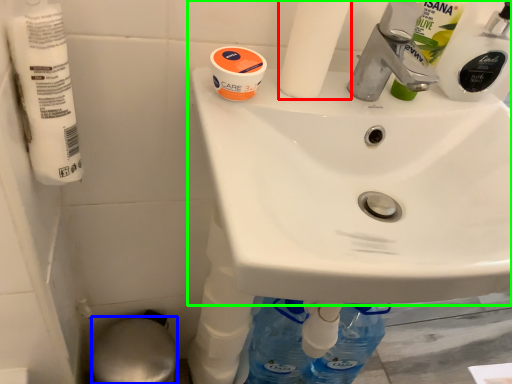
Question: Based on their relative distances, which object is farther from toilet paper (highlighted by a red box)? Choose from bidet (highlighted by a blue box) and sink (highlighted by a green box).

Choices:
 (A) bidet
 (B) sink

Answer: (A)